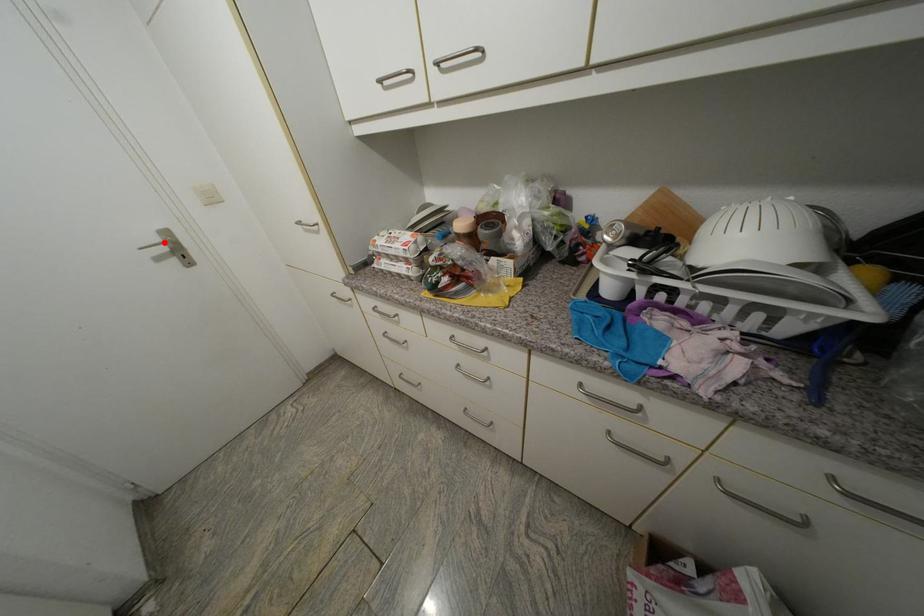
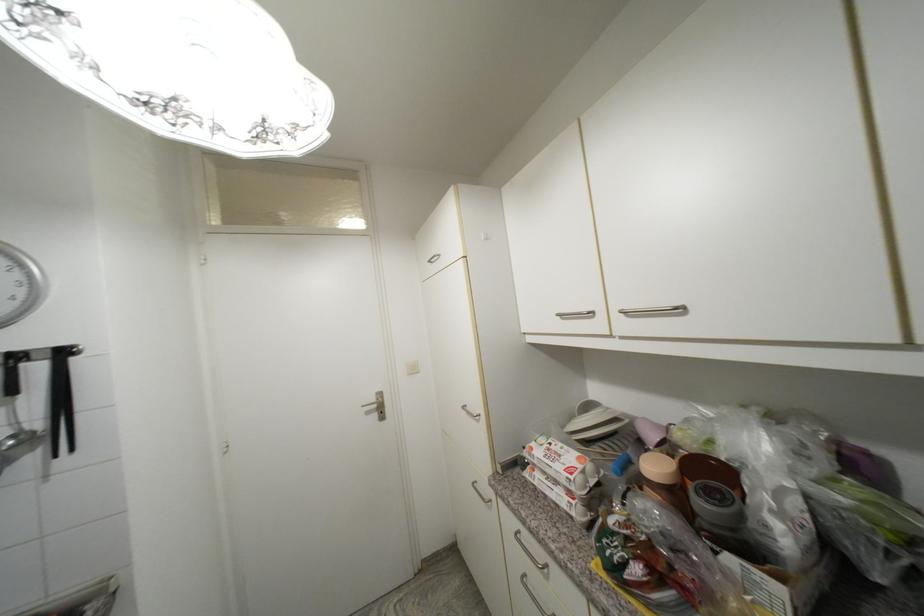
Question: I am providing you with two images of the same scene from different viewpoints. A red point is marked on the first image. Can you still see the location of the red point in image 2?

Choices:
 (A) Yes
 (B) No

Answer: (A)